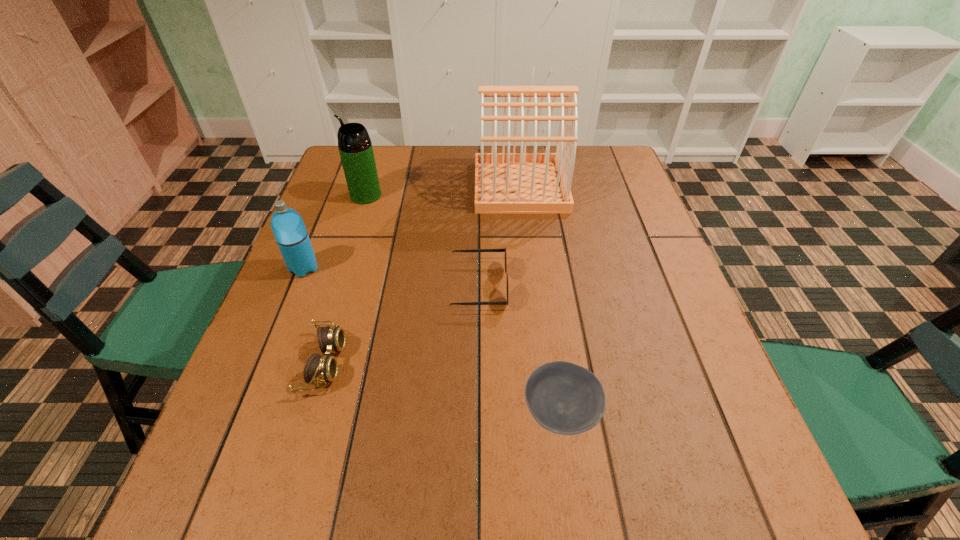
Locate an element on the screen. free space between the bowl and the sunglasses is located at coordinates (520, 349).

The image size is (960, 540). In order to click on free spot between the goggles and the tallest object in this screenshot , I will do `click(422, 275)`.

Find the location of a particular element. This screenshot has height=540, width=960. vacant area that lies between the goggles and the second tallest object is located at coordinates (346, 279).

At what (x,y) coordinates should I click in order to perform the action: click on empty space that is in between the shorter thermos bottle and the bowl. Please return your answer as a coordinate pair (x, y). Looking at the image, I should click on (432, 340).

Image resolution: width=960 pixels, height=540 pixels. Identify the location of free spot between the taller thermos bottle and the sunglasses. pos(422,240).

At what (x,y) coordinates should I click in order to perform the action: click on free spot between the fifth shortest object and the sunglasses. Please return your answer as a coordinate pair (x, y). This screenshot has height=540, width=960. Looking at the image, I should click on (422, 240).

This screenshot has height=540, width=960. I want to click on the third closest object to the right thermos bottle, so click(x=503, y=249).

The width and height of the screenshot is (960, 540). I want to click on object that is the closest to the leftmost object, so click(318, 369).

Where is `free spot that satisfies the following two spatial constraints: 1. on the front-facing side of the bowl; 2. on the right side of the sunglasses`? This screenshot has height=540, width=960. free spot that satisfies the following two spatial constraints: 1. on the front-facing side of the bowl; 2. on the right side of the sunglasses is located at coordinates (479, 412).

Find the location of a particular element. The width and height of the screenshot is (960, 540). free location that satisfies the following two spatial constraints: 1. on the back side of the bowl; 2. through the lenses of the goggles is located at coordinates (554, 363).